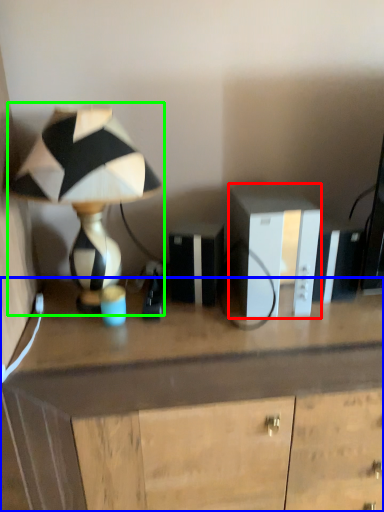
Question: Estimate the real-world distances between objects in this image. Which object is closer to cabinetry (highlighted by a red box), desk (highlighted by a blue box) or lamp (highlighted by a green box)?

Choices:
 (A) desk
 (B) lamp

Answer: (A)